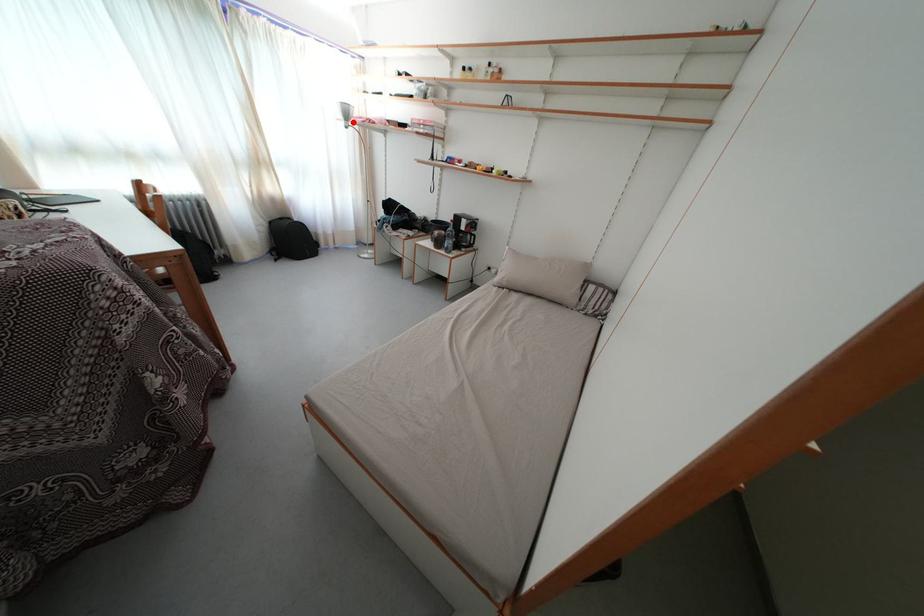
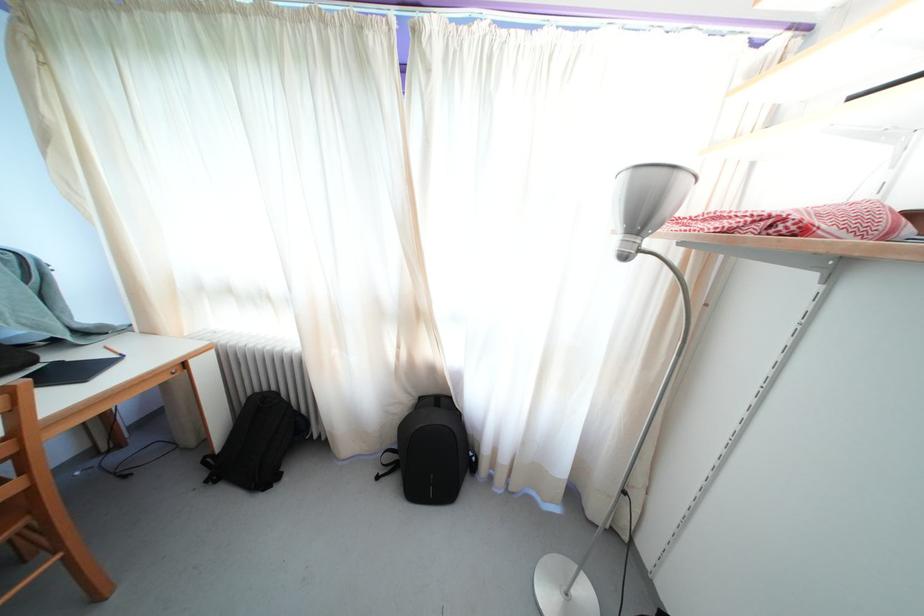
The point at the highlighted location is marked in the first image. Where is the corresponding point in the second image?

(648, 223)